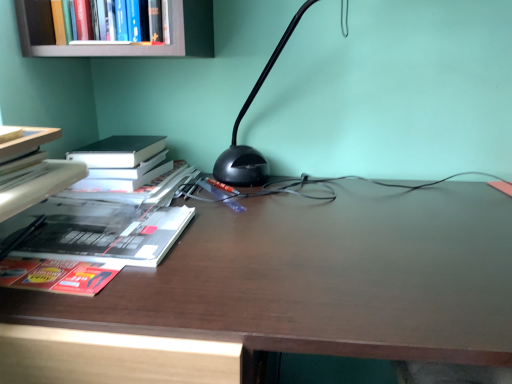
Question: Can you confirm if hardcover book at left, acting as the 3th book starting from the top, is bigger than black plastic lamp at center?

Choices:
 (A) no
 (B) yes

Answer: (A)

Question: Is hardcover book at left, acting as the 3th book starting from the top, not within black plastic lamp at center?

Choices:
 (A) no
 (B) yes

Answer: (B)

Question: Are hardcover book at left, acting as the 3th book starting from the top, and black plastic lamp at center far apart?

Choices:
 (A) no
 (B) yes

Answer: (A)

Question: Considering the relative sizes of hardcover book at left, acting as the 3th book starting from the top, and black plastic lamp at center in the image provided, is hardcover book at left, acting as the 3th book starting from the top, taller than black plastic lamp at center?

Choices:
 (A) no
 (B) yes

Answer: (A)

Question: Is black plastic lamp at center located within hardcover book at left, acting as the 3th book starting from the top?

Choices:
 (A) no
 (B) yes

Answer: (A)

Question: Is point (266, 175) closer or farther from the camera than point (146, 220)?

Choices:
 (A) farther
 (B) closer

Answer: (A)

Question: Is black plastic lamp at center bigger or smaller than hardcover book at left, acting as the 3th book starting from the top?

Choices:
 (A) big
 (B) small

Answer: (A)

Question: In terms of width, does black plastic lamp at center look wider or thinner when compared to hardcover book at left, placed as the first book when sorted from bottom to top?

Choices:
 (A) wide
 (B) thin

Answer: (A)

Question: Is black plastic lamp at center spatially inside hardcover book at left, acting as the 3th book starting from the top, or outside of it?

Choices:
 (A) inside
 (B) outside

Answer: (B)

Question: In terms of size, does hardcover book at left, acting as the 3th book starting from the top, appear bigger or smaller than hardcover book at upper left, the first book from the top?

Choices:
 (A) big
 (B) small

Answer: (B)

Question: From a real-world perspective, is hardcover book at left, acting as the 3th book starting from the top, physically located above or below hardcover book at upper left, the 3th book when ordered from bottom to top?

Choices:
 (A) below
 (B) above

Answer: (A)

Question: Is hardcover book at left, placed as the first book when sorted from bottom to top, inside or outside of hardcover book at upper left, the first book from the top?

Choices:
 (A) outside
 (B) inside

Answer: (A)

Question: Is hardcover book at left, placed as the first book when sorted from bottom to top, taller or shorter than hardcover book at upper left, the first book from the top?

Choices:
 (A) tall
 (B) short

Answer: (B)

Question: In the image, is hardcover book at left, placed as the first book when sorted from bottom to top, positioned in front of or behind white paper at left, the second book from the bottom?

Choices:
 (A) behind
 (B) front

Answer: (A)

Question: Is hardcover book at left, acting as the 3th book starting from the top, spatially inside white paper at left, the second book from the bottom, or outside of it?

Choices:
 (A) outside
 (B) inside

Answer: (A)